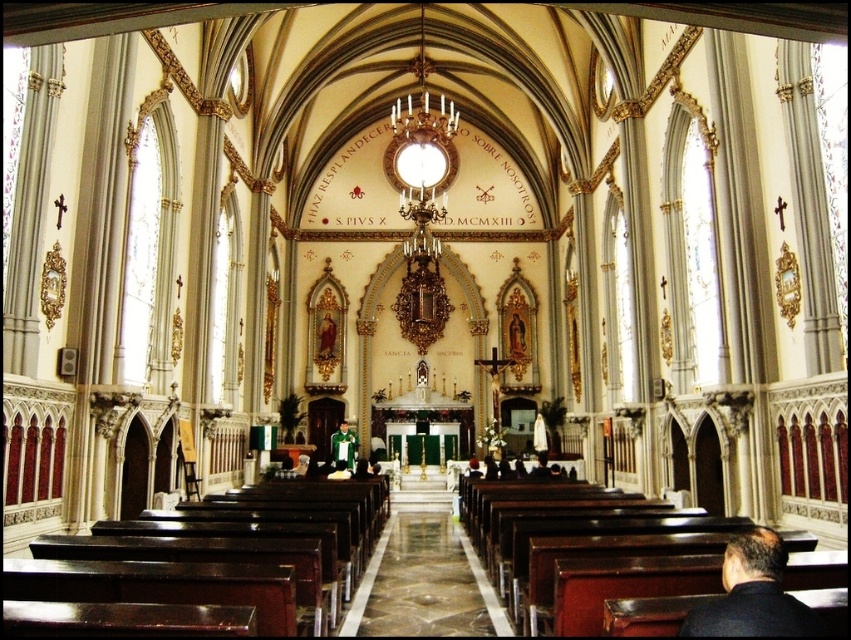
Based on the photo, you are an interior designer planning to place a new decorative item in the church. You notice the dark brown leather jacket at lower right and the green velvet suit at center. Which object is covering the other one?

The dark brown leather jacket at lower right is positioned over the green velvet suit at center, so it is covering the other object.

You are a tailor who needs to determine which garment takes up more horizontal space. Which one is wider between the dark brown leather jacket at lower right and the green velvet suit at center?

The green velvet suit at center is wider than the dark brown leather jacket at lower right.

You are standing in the church and want to take a photo of the green velvet suit at center without the dark brown leather jacket at lower right blocking the view. Is this possible?

The dark brown leather jacket at lower right is in front of the green velvet suit at center, so it is blocking the view. To take a photo of the green velvet suit at center without the jacket blocking, you would need to move around to a different angle where the jacket is not in front.